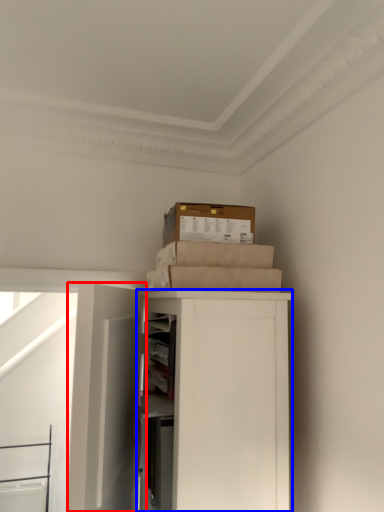
Question: Which of the following is the closest to the observer, door (highlighted by a red box) or cabinetry (highlighted by a blue box)?

Choices:
 (A) door
 (B) cabinetry

Answer: (A)